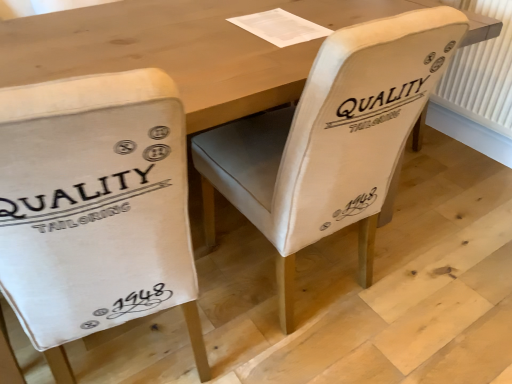
What do you see at coordinates (482, 72) in the screenshot? I see `white plastic radiator at right` at bounding box center [482, 72].

I want to click on white fabric chair at center, which appears as the first chair when viewed from the right, so click(x=331, y=140).

Between white plastic radiator at right and white canvas chair at left, which ranks as the 2th chair in right-to-left order, which one has larger size?

With larger size is white canvas chair at left, which ranks as the 2th chair in right-to-left order.

Is the surface of white plastic radiator at right in direct contact with white canvas chair at left, acting as the first chair starting from the left?

There is a gap between white plastic radiator at right and white canvas chair at left, acting as the first chair starting from the left.

Looking at their sizes, would you say white plastic radiator at right is wider or thinner than white canvas chair at left, which ranks as the 2th chair in right-to-left order?

Considering their sizes, white plastic radiator at right looks slimmer than white canvas chair at left, which ranks as the 2th chair in right-to-left order.

Is point (480, 70) closer or farther from the camera than point (64, 293)?

Point (480, 70).

Locate an element on the screen. chair on the right of white canvas chair at left, which ranks as the 2th chair in right-to-left order is located at coordinates (331, 140).

Which object is positioned more to the left, white fabric chair at center, the 2th chair from the left, or white canvas chair at left, which ranks as the 2th chair in right-to-left order?

white canvas chair at left, which ranks as the 2th chair in right-to-left order, is more to the left.

Looking at this image, from a real-world perspective, between white fabric chair at center, which appears as the first chair when viewed from the right, and white canvas chair at left, which ranks as the 2th chair in right-to-left order, who is vertically lower?

white fabric chair at center, which appears as the first chair when viewed from the right, from a real-world perspective.

Measure the distance between white fabric chair at center, the 2th chair from the left, and white canvas chair at left, acting as the first chair starting from the left.

17.08 inches.

From a real-world perspective, is white canvas chair at left, which ranks as the 2th chair in right-to-left order, beneath white fabric chair at center, the 2th chair from the left?

Actually, white canvas chair at left, which ranks as the 2th chair in right-to-left order, is physically above white fabric chair at center, the 2th chair from the left, in the real world.

Which of these two, white canvas chair at left, acting as the first chair starting from the left, or white fabric chair at center, the 2th chair from the left, is bigger?

With larger size is white canvas chair at left, acting as the first chair starting from the left.

Considering the sizes of white canvas chair at left, acting as the first chair starting from the left, and white fabric chair at center, which appears as the first chair when viewed from the right, in the image, is white canvas chair at left, acting as the first chair starting from the left, taller or shorter than white fabric chair at center, which appears as the first chair when viewed from the right,?

Clearly, white canvas chair at left, acting as the first chair starting from the left, is shorter compared to white fabric chair at center, which appears as the first chair when viewed from the right.

From the image's perspective, is white fabric chair at center, which appears as the first chair when viewed from the right, under white plastic radiator at right?

Yes.

Based on the photo, how different are the orientations of white fabric chair at center, which appears as the first chair when viewed from the right, and white plastic radiator at right in degrees?

They differ by 94.4 degrees in their facing directions.

Looking at this image, how far apart are white fabric chair at center, the 2th chair from the left, and white plastic radiator at right?

A distance of 1.17 meters exists between white fabric chair at center, the 2th chair from the left, and white plastic radiator at right.

The width and height of the screenshot is (512, 384). Identify the location of the 1st chair in front when counting from the white plastic radiator at right. (331, 140).

Would you consider white plastic radiator at right to be distant from white fabric chair at center, the 2th chair from the left?

Indeed, white plastic radiator at right is not near white fabric chair at center, the 2th chair from the left.

Which chair is the 1st one when counting from the front of the white plastic radiator at right? Please provide its 2D coordinates.

[(331, 140)]

Considering the relative positions of white plastic radiator at right and white fabric chair at center, which appears as the first chair when viewed from the right, in the image provided, is white plastic radiator at right to the left or to the right of white fabric chair at center, which appears as the first chair when viewed from the right,?

Clearly, white plastic radiator at right is on the right of white fabric chair at center, which appears as the first chair when viewed from the right, in the image.

From the image's perspective, between white plastic radiator at right and white fabric chair at center, which appears as the first chair when viewed from the right, who is located below?

white fabric chair at center, which appears as the first chair when viewed from the right, appears lower in the image.

From a real-world perspective, which object stands above the other?

white canvas chair at left, which ranks as the 2th chair in right-to-left order, from a real-world perspective.

Considering the points (134, 118) and (459, 56), which point is in front, point (134, 118) or point (459, 56)?

The point (134, 118) is closer.

The height and width of the screenshot is (384, 512). There is a white plastic radiator at right. What are the coordinates of `the 2nd chair above it (from a real-world perspective)` in the screenshot? It's located at (95, 208).

Which object is wider, white canvas chair at left, which ranks as the 2th chair in right-to-left order, or white plastic radiator at right?

white canvas chair at left, which ranks as the 2th chair in right-to-left order, is wider.

Where is `radiator that appears on the right of white canvas chair at left, acting as the first chair starting from the left`? radiator that appears on the right of white canvas chair at left, acting as the first chair starting from the left is located at coordinates (482, 72).

Locate an element on the screen. chair above the white canvas chair at left, acting as the first chair starting from the left (from the image's perspective) is located at coordinates (331, 140).

Consider the image. When comparing their distances from white fabric chair at center, which appears as the first chair when viewed from the right, does white canvas chair at left, which ranks as the 2th chair in right-to-left order, or white plastic radiator at right seem closer?

The object closer to white fabric chair at center, which appears as the first chair when viewed from the right, is white canvas chair at left, which ranks as the 2th chair in right-to-left order.

Looking at the image, which one is located closer to white fabric chair at center, the 2th chair from the left, white plastic radiator at right or white canvas chair at left, acting as the first chair starting from the left?

white canvas chair at left, acting as the first chair starting from the left.

Looking at the image, which one is located further to white canvas chair at left, which ranks as the 2th chair in right-to-left order, white fabric chair at center, the 2th chair from the left, or white plastic radiator at right?

The object further to white canvas chair at left, which ranks as the 2th chair in right-to-left order, is white plastic radiator at right.

Which object lies further to the anchor point white plastic radiator at right, white canvas chair at left, which ranks as the 2th chair in right-to-left order, or white fabric chair at center, the 2th chair from the left?

white canvas chair at left, which ranks as the 2th chair in right-to-left order, is positioned further to the anchor white plastic radiator at right.

Considering their positions, is white fabric chair at center, the 2th chair from the left, positioned further to white plastic radiator at right than white canvas chair at left, acting as the first chair starting from the left?

The object further to white plastic radiator at right is white canvas chair at left, acting as the first chair starting from the left.

Looking at the image, which one is located further to white canvas chair at left, acting as the first chair starting from the left, white plastic radiator at right or white fabric chair at center, which appears as the first chair when viewed from the right?

white plastic radiator at right is positioned further to the anchor white canvas chair at left, acting as the first chair starting from the left.

Where is `chair situated between white canvas chair at left, acting as the first chair starting from the left, and white plastic radiator at right from left to right`? chair situated between white canvas chair at left, acting as the first chair starting from the left, and white plastic radiator at right from left to right is located at coordinates (331, 140).